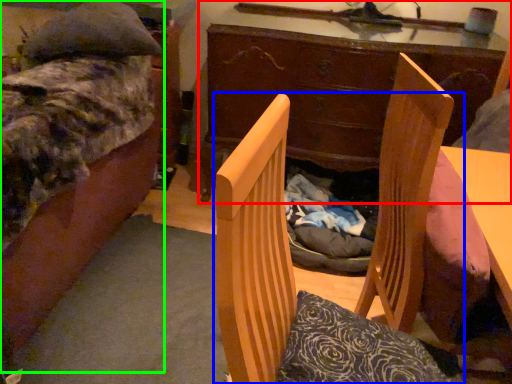
Question: Which is farther away from desk (highlighted by a red box)? chair (highlighted by a blue box) or bed (highlighted by a green box)?

Choices:
 (A) chair
 (B) bed

Answer: (A)